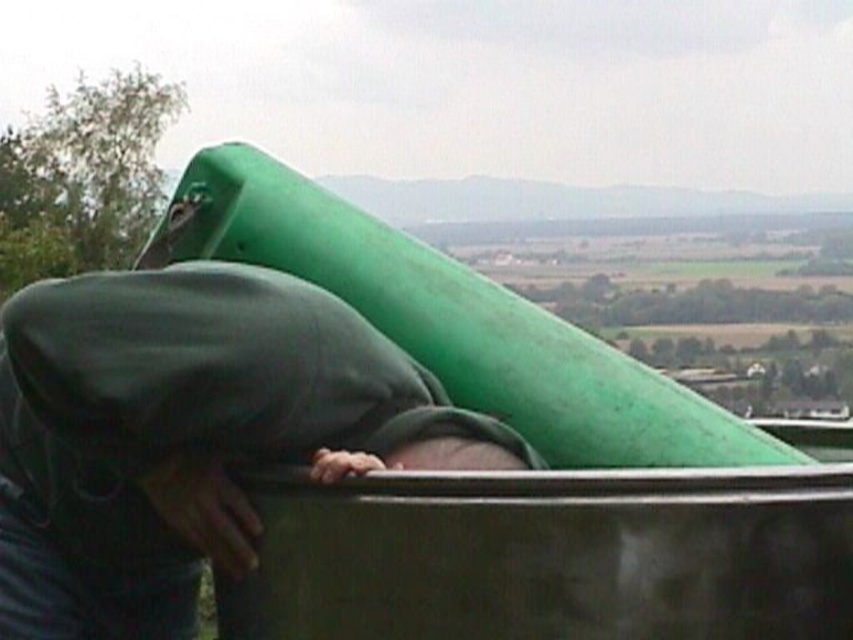
From the picture: You are designing a costume for a theater play and need to decide between using the dark green fabric at center and the green rubber slide at upper center for a character who needs a flexible material that can stretch. Which object from the scene would be more suitable for this purpose?

The green rubber slide at upper center is more suitable because it is made of rubber, which is known for its flexibility and stretchiness, unlike the dark green fabric at center which is likely less stretchy.

You are designing a safety inspection report for this structure. Based on the image, which object takes up more area in the scene between the dark green fabric at center and the green rubber slide at upper center?

The green rubber slide at upper center occupies more space than the dark green fabric at center according to the description.